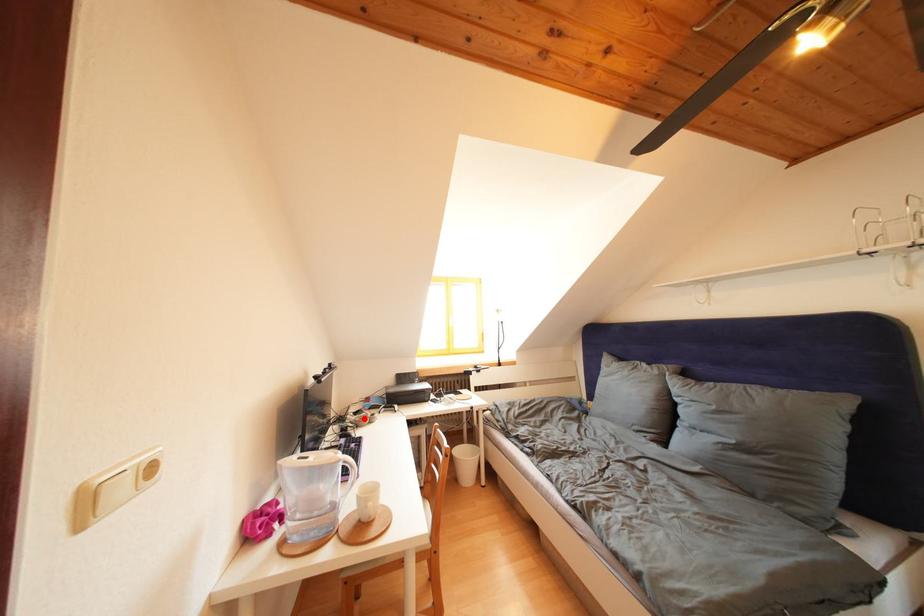
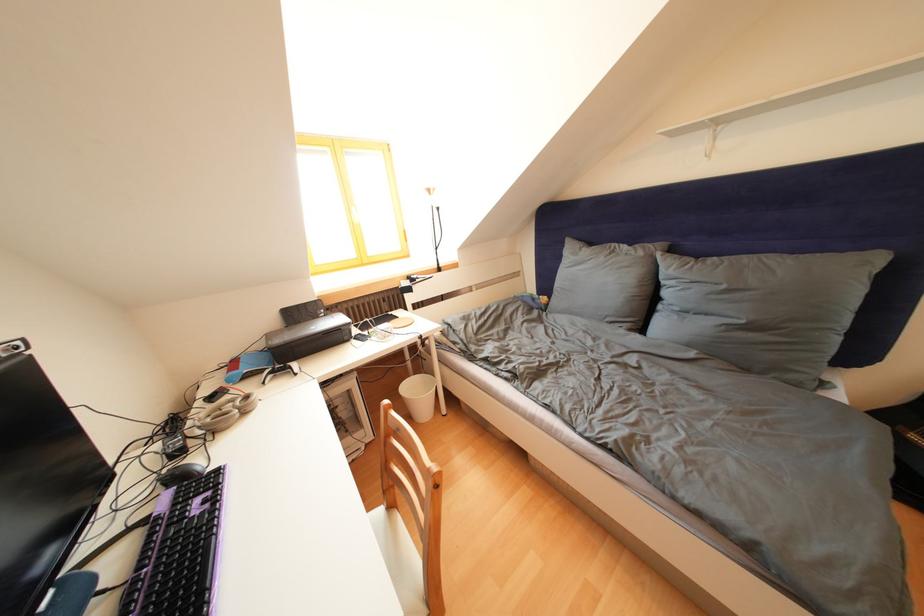
Question: I am providing you with two images of the same scene from different viewpoints. A red point is shown in image1. For the corresponding object point in image2, is it positioned nearer or farther from the camera?

Choices:
 (A) Nearer
 (B) Farther

Answer: (A)